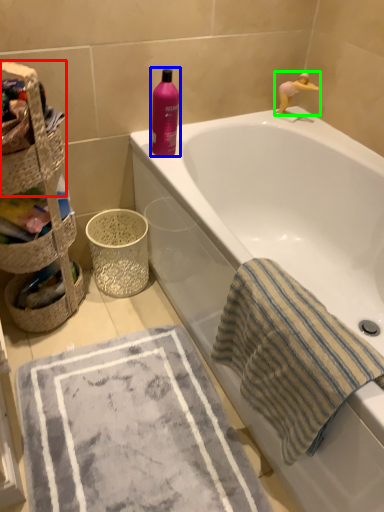
Question: Which object is positioned farthest from basket container (highlighted by a red box)? Select from cleaning product (highlighted by a blue box) and toy (highlighted by a green box).

Choices:
 (A) cleaning product
 (B) toy

Answer: (B)